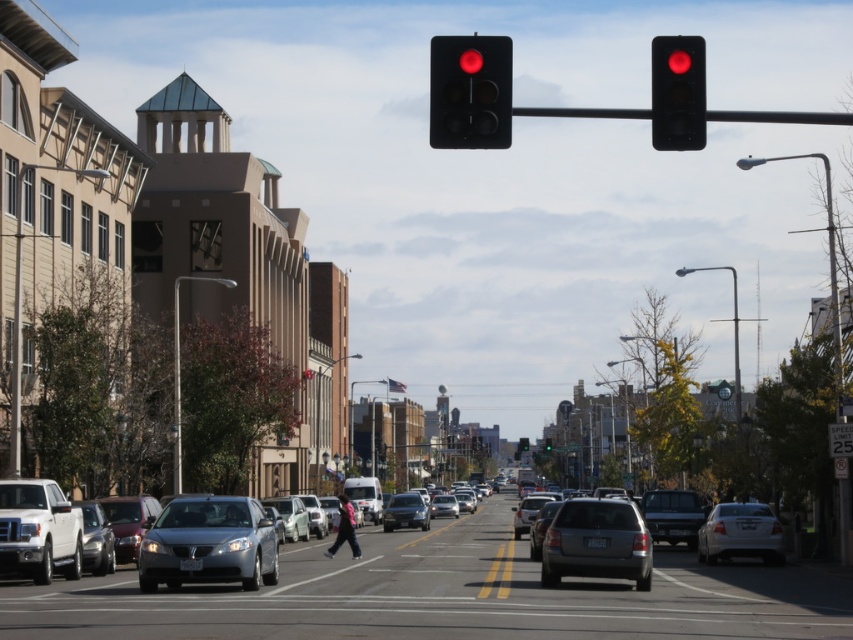
You are a pedestrian waiting to cross the street. You notice the matte black traffic light at upper center and the matte black truck at center. Which object appears larger in the image?

The matte black traffic light at upper center appears larger than the matte black truck at center in the image.

You are a delivery driver who needs to park your vehicle in a spot that can accommodate your truck, which is larger than the satin silver sedan at lower left. Based on the scene, is there a suitable parking spot available near the green glass traffic light at center?

The satin silver sedan at lower left occupies less space than the green glass traffic light at center, so the parking spot near the green glass traffic light at center may have enough space to accommodate a larger vehicle like your truck.

You are a pedestrian standing at the crosswalk near the satin silver sedan at lower left. You want to cross the street to the opposite side. Based on the traffic light signals, is it safe to proceed?

The traffic lights above the street are both illuminated red, so vehicles including the satin silver sedan at lower left must stop. It is safe to proceed across the crosswalk.